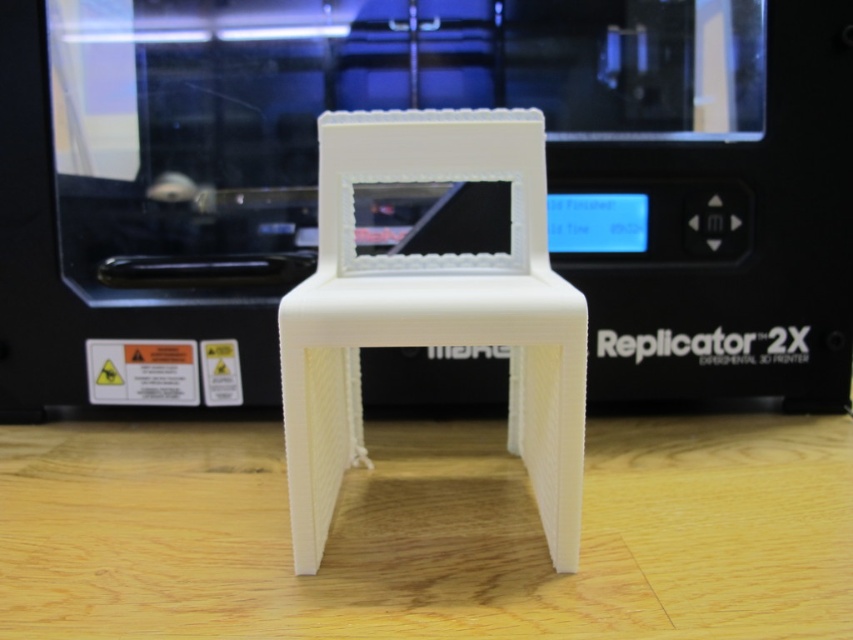
Question: In this image, where is white matte chair at center located relative to white matte plastic chair at center?

Choices:
 (A) above
 (B) below

Answer: (B)

Question: Which of the following is the farthest from the observer?

Choices:
 (A) (831, 458)
 (B) (583, 301)

Answer: (A)

Question: Is the position of white matte chair at center more distant than that of white matte plastic chair at center?

Choices:
 (A) yes
 (B) no

Answer: (B)

Question: Considering the relative positions of white matte chair at center and white matte plastic chair at center in the image provided, where is white matte chair at center located with respect to white matte plastic chair at center?

Choices:
 (A) above
 (B) below

Answer: (B)

Question: Which object appears closest to the camera in this image?

Choices:
 (A) white matte chair at center
 (B) white matte plastic chair at center

Answer: (A)